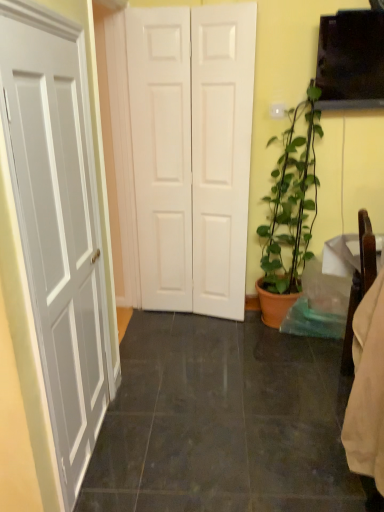
Question: Is the surface of matte terracotta pot at right in direct contact with black glossy tile at center?

Choices:
 (A) no
 (B) yes

Answer: (A)

Question: From a real-world perspective, is matte terracotta pot at right physically above black glossy tile at center?

Choices:
 (A) yes
 (B) no

Answer: (A)

Question: Is matte terracotta pot at right completely or partially outside of black glossy tile at center?

Choices:
 (A) no
 (B) yes

Answer: (B)

Question: Is matte terracotta pot at right far from black glossy tile at center?

Choices:
 (A) yes
 (B) no

Answer: (B)

Question: Is the position of matte terracotta pot at right more distant than that of black glossy tile at center?

Choices:
 (A) yes
 (B) no

Answer: (A)

Question: Can you confirm if matte terracotta pot at right is positioned to the left of black glossy tile at center?

Choices:
 (A) yes
 (B) no

Answer: (B)

Question: Is white matte door at center outside matte terracotta pot at right?

Choices:
 (A) yes
 (B) no

Answer: (A)

Question: Considering the relative sizes of white matte door at center and matte terracotta pot at right in the image provided, is white matte door at center thinner than matte terracotta pot at right?

Choices:
 (A) yes
 (B) no

Answer: (A)

Question: Does white matte door at center have a lesser height compared to matte terracotta pot at right?

Choices:
 (A) no
 (B) yes

Answer: (A)

Question: Considering the relative sizes of white matte door at center and matte terracotta pot at right in the image provided, is white matte door at center taller than matte terracotta pot at right?

Choices:
 (A) yes
 (B) no

Answer: (A)

Question: Does white matte door at center turn towards matte terracotta pot at right?

Choices:
 (A) yes
 (B) no

Answer: (B)

Question: Is white matte door at center far away from matte terracotta pot at right?

Choices:
 (A) yes
 (B) no

Answer: (B)

Question: Is matte terracotta pot at right shorter than white matte door at center?

Choices:
 (A) yes
 (B) no

Answer: (A)